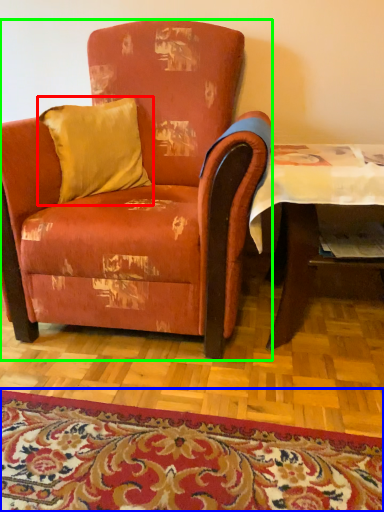
Question: Which is nearer to the pillow (highlighted by a red box)? mat (highlighted by a blue box) or chair (highlighted by a green box).

Choices:
 (A) mat
 (B) chair

Answer: (B)